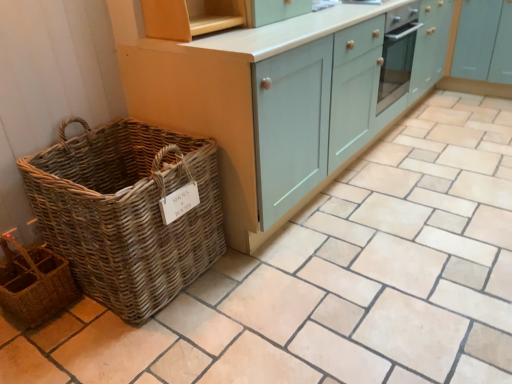
Locate an element on the screen. The height and width of the screenshot is (384, 512). free spot to the right of rustic wicker basket at lower left is located at coordinates (87, 324).